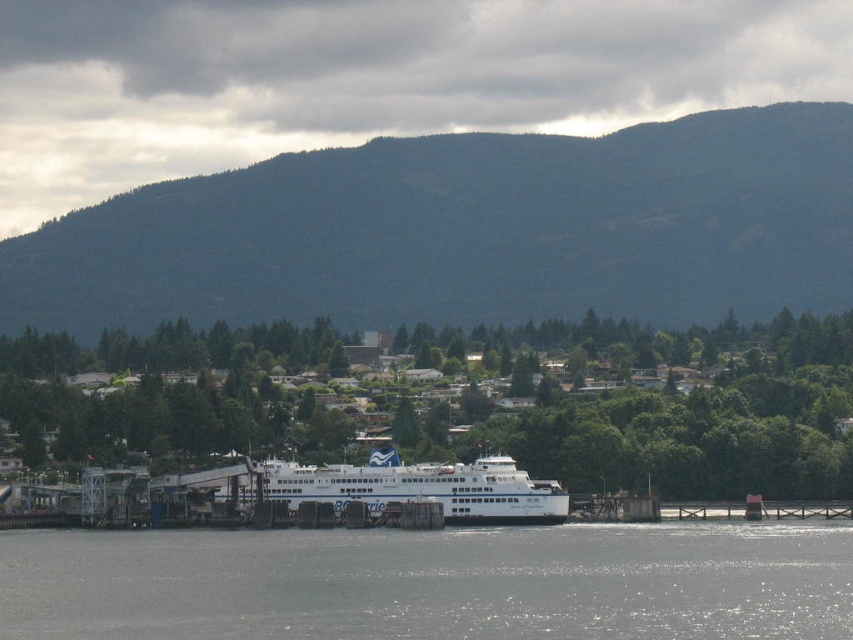
Is green leafy tree at center above white glossy ferry at center?

Yes.

Who is more distant from viewer, (830, 481) or (370, 508)?

Point (830, 481)

Where is `green leafy tree at center`? green leafy tree at center is located at coordinates (660, 410).

Consider the image. Between green forested mountain at upper center and clear water at lower center, which one appears on the left side from the viewer's perspective?

From the viewer's perspective, clear water at lower center appears more on the left side.

Between green forested mountain at upper center and clear water at lower center, which one is positioned lower?

clear water at lower center is below.

Who is more distant from viewer, (242, 184) or (468, 593)?

Positioned behind is point (242, 184).

The image size is (853, 640). I want to click on green forested mountain at upper center, so click(468, 230).

Can you confirm if green forested mountain at upper center is wider than green leafy tree at center?

Yes, green forested mountain at upper center is wider than green leafy tree at center.

Who is taller, green forested mountain at upper center or green leafy tree at center?

green forested mountain at upper center is taller.

Between point (486, 260) and point (192, 369), which one is positioned in front?

Point (192, 369) is in front.

Find the location of `green forested mountain at upper center`. green forested mountain at upper center is located at coordinates (468, 230).